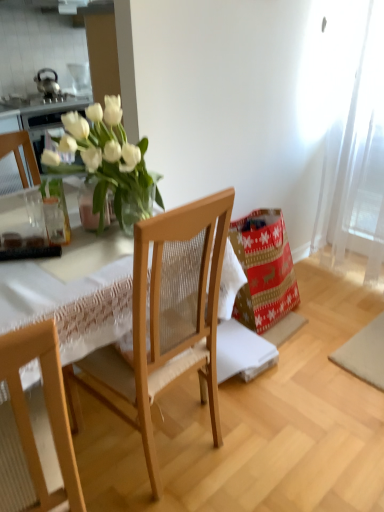
Where is `vacant area that is in front of clear glass vase at left`? The image size is (384, 512). vacant area that is in front of clear glass vase at left is located at coordinates (60, 263).